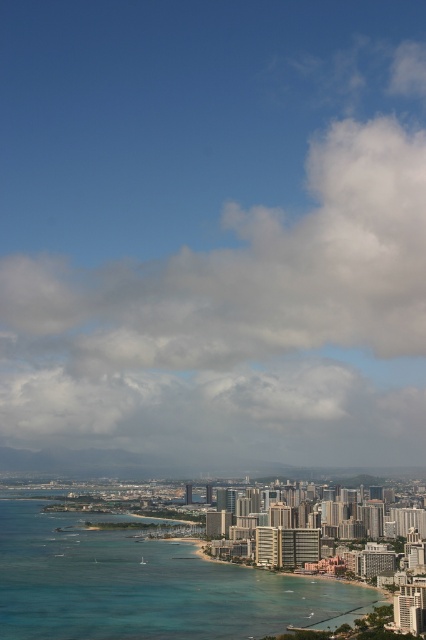
Does white fluffy cloud at upper center have a larger size compared to clear blue water at lower center?

Indeed, white fluffy cloud at upper center has a larger size compared to clear blue water at lower center.

Between white fluffy cloud at upper center and clear blue water at lower center, which one is positioned higher?

white fluffy cloud at upper center is higher up.

Locate an element on the screen. white fluffy cloud at upper center is located at coordinates (227, 285).